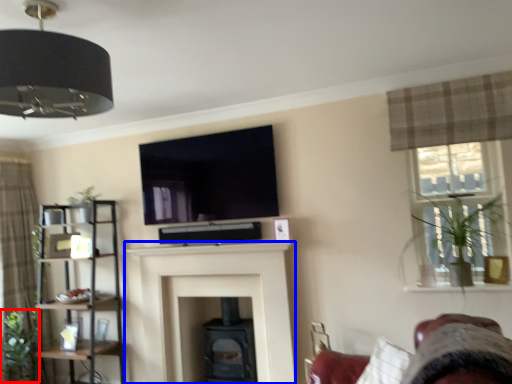
Question: Which object appears farthest to the camera in this image, plant (highlighted by a red box) or fireplace (highlighted by a blue box)?

Choices:
 (A) plant
 (B) fireplace

Answer: (A)